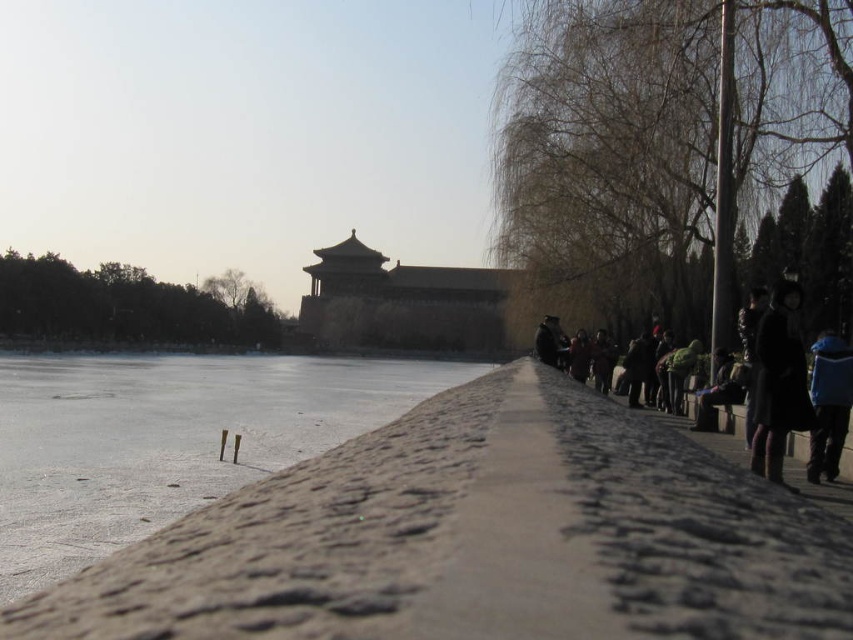
Which is behind, point (770, 426) or point (824, 397)?

The point (824, 397) is more distant.

Who is more forward, (773, 346) or (840, 390)?

Point (773, 346) is in front.

Is point (788, 346) farther from viewer compared to point (838, 349)?

No, (788, 346) is in front of (838, 349).

You are a GUI agent. You are given a task and a screenshot of the screen. Output one action in this format:
    pyautogui.click(x=<x>, y=<y>)
    Task: Click on the dark blue coat at right
    This screenshot has height=640, width=853.
    Given the screenshot: What is the action you would take?
    pyautogui.click(x=779, y=385)

Consider the image. Does dark wool coat at right have a smaller size compared to blue fabric jacket at right?

Indeed, dark wool coat at right has a smaller size compared to blue fabric jacket at right.

At what (x,y) coordinates should I click in order to perform the action: click on dark wool coat at right. Please return your answer as a coordinate pair (x, y). This screenshot has height=640, width=853. Looking at the image, I should click on pyautogui.click(x=778, y=381).

Is point (773, 308) positioned in front of point (822, 362)?

Yes, point (773, 308) is closer to viewer.

Where is `dark wool coat at right`? The height and width of the screenshot is (640, 853). dark wool coat at right is located at coordinates (778, 381).

Does frozen ice at lower left appear on the left side of dark wool coat at right?

Correct, you'll find frozen ice at lower left to the left of dark wool coat at right.

In the scene shown: Which is above, frozen ice at lower left or dark wool coat at right?

dark wool coat at right

Is point (328, 436) positioned before point (802, 390)?

No, it is behind (802, 390).

At what (x,y) coordinates should I click in order to perform the action: click on frozen ice at lower left. Please return your answer as a coordinate pair (x, y). This screenshot has height=640, width=853. Looking at the image, I should click on (167, 440).